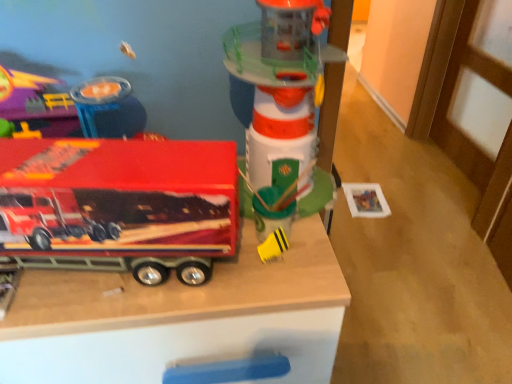
Image resolution: width=512 pixels, height=384 pixels. Find the location of `vacant space situated on the left part of yellow rubber duck at center, the 3th toy viewed from the left`. vacant space situated on the left part of yellow rubber duck at center, the 3th toy viewed from the left is located at coordinates (179, 285).